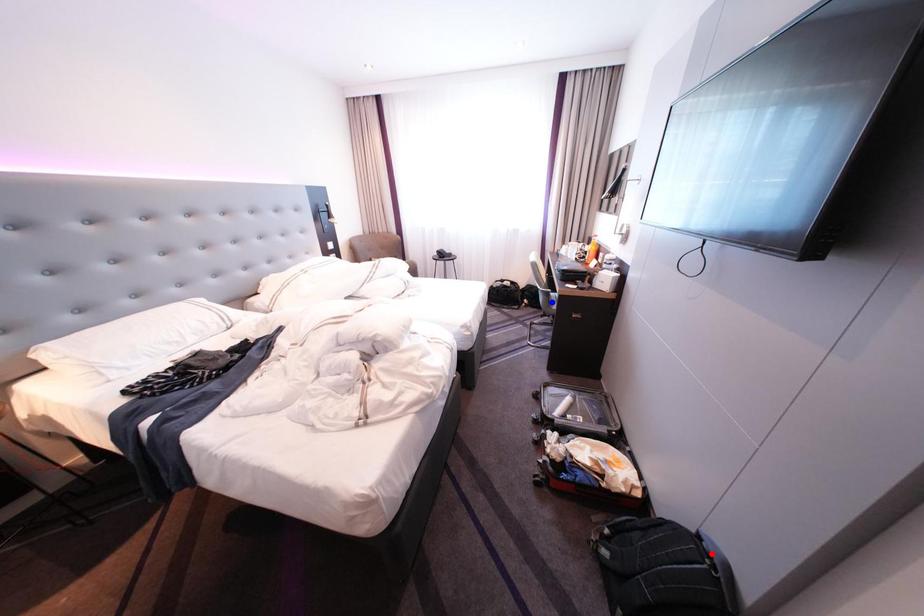
Question: Which of the two points in the image is closer to the camera?

Choices:
 (A) Blue point is closer.
 (B) Red point is closer.

Answer: (B)